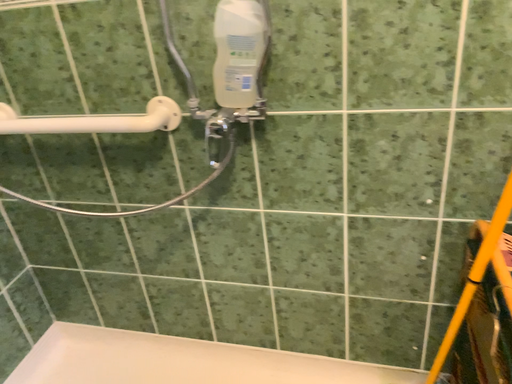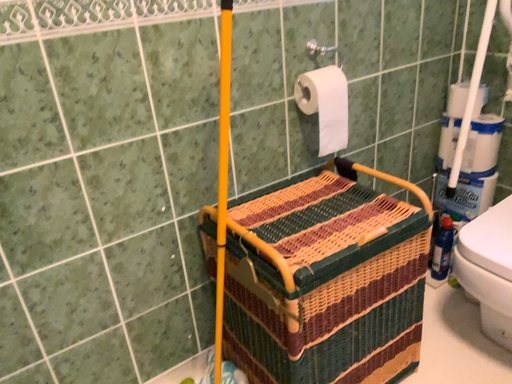
Question: How did the camera likely rotate when shooting the video?

Choices:
 (A) rotated right
 (B) rotated left

Answer: (A)